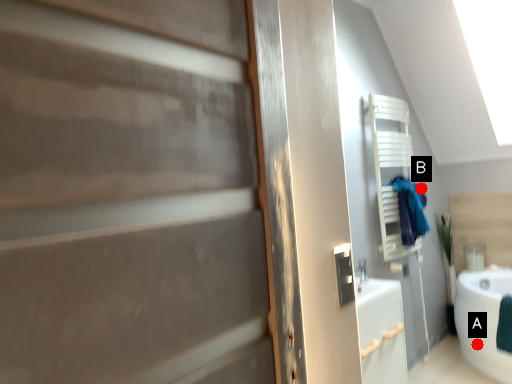
Question: Two points are circled on the image, labeled by A and B beside each circle. Which point is closer to the camera taking this photo?

Choices:
 (A) A is closer
 (B) B is closer

Answer: (A)